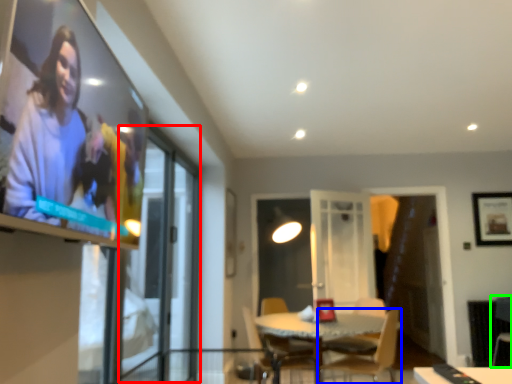
Question: Which object is the farthest from screen door (highlighted by a red box)? Choose among these: chair (highlighted by a blue box) or armchair (highlighted by a green box).

Choices:
 (A) chair
 (B) armchair

Answer: (B)